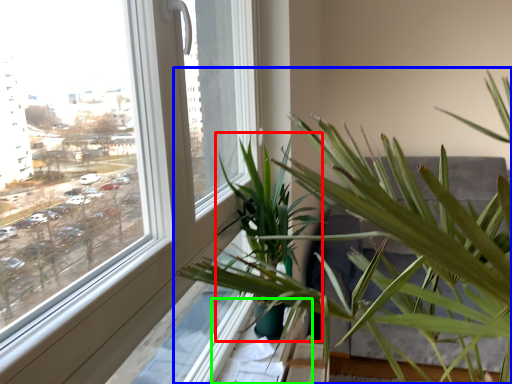
Question: Which object is the farthest from palm tree (highlighted by a red box)? Choose among these: houseplant (highlighted by a blue box) or window sill (highlighted by a green box).

Choices:
 (A) houseplant
 (B) window sill

Answer: (B)